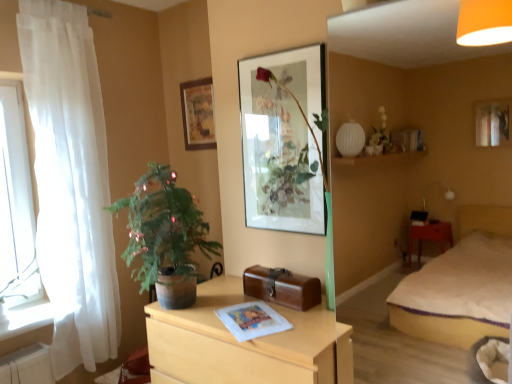
Question: Which direction should I rotate to face matte glass picture frame at center, the 2th picture frame from the left, — up or down?

Choices:
 (A) down
 (B) up

Answer: (B)

Question: Is transparent glass window at left wider than wooden chest of drawers at center?

Choices:
 (A) no
 (B) yes

Answer: (A)

Question: Can you confirm if transparent glass window at left is bigger than wooden chest of drawers at center?

Choices:
 (A) no
 (B) yes

Answer: (A)

Question: Is transparent glass window at left turned away from wooden chest of drawers at center?

Choices:
 (A) no
 (B) yes

Answer: (A)

Question: Is the surface of transparent glass window at left in direct contact with wooden chest of drawers at center?

Choices:
 (A) yes
 (B) no

Answer: (B)

Question: From a real-world perspective, is transparent glass window at left physically below wooden chest of drawers at center?

Choices:
 (A) no
 (B) yes

Answer: (A)

Question: Is transparent glass window at left behind wooden chest of drawers at center?

Choices:
 (A) no
 (B) yes

Answer: (B)

Question: Considering the relative sizes of green matte potted plant at left and matte glass picture frame at center, placed as the first picture frame when sorted from right to left, in the image provided, is green matte potted plant at left wider than matte glass picture frame at center, placed as the first picture frame when sorted from right to left,?

Choices:
 (A) yes
 (B) no

Answer: (A)

Question: Does green matte potted plant at left appear on the right side of matte glass picture frame at center, placed as the first picture frame when sorted from right to left?

Choices:
 (A) no
 (B) yes

Answer: (A)

Question: Is green matte potted plant at left not near matte glass picture frame at center, the second picture frame from the back?

Choices:
 (A) no
 (B) yes

Answer: (A)

Question: Is green matte potted plant at left oriented away from matte glass picture frame at center, arranged as the 1th picture frame when viewed from the front?

Choices:
 (A) yes
 (B) no

Answer: (A)

Question: From a real-world perspective, is green matte potted plant at left physically below matte glass picture frame at center, placed as the first picture frame when sorted from right to left?

Choices:
 (A) no
 (B) yes

Answer: (B)

Question: Is the surface of green matte potted plant at left in direct contact with matte glass picture frame at center, placed as the first picture frame when sorted from right to left?

Choices:
 (A) no
 (B) yes

Answer: (A)

Question: Is wooden chest of drawers at center at the back of green matte potted plant at left?

Choices:
 (A) yes
 (B) no

Answer: (B)